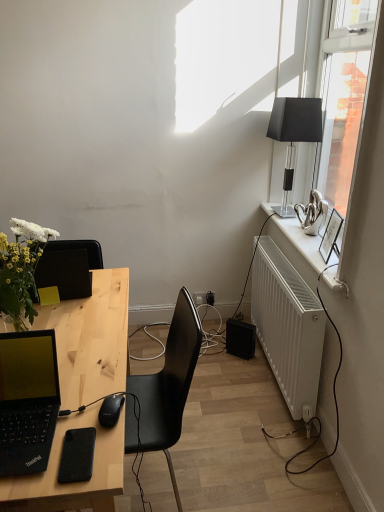
Identify the location of free space in front of white matte radiator at right. (266, 443).